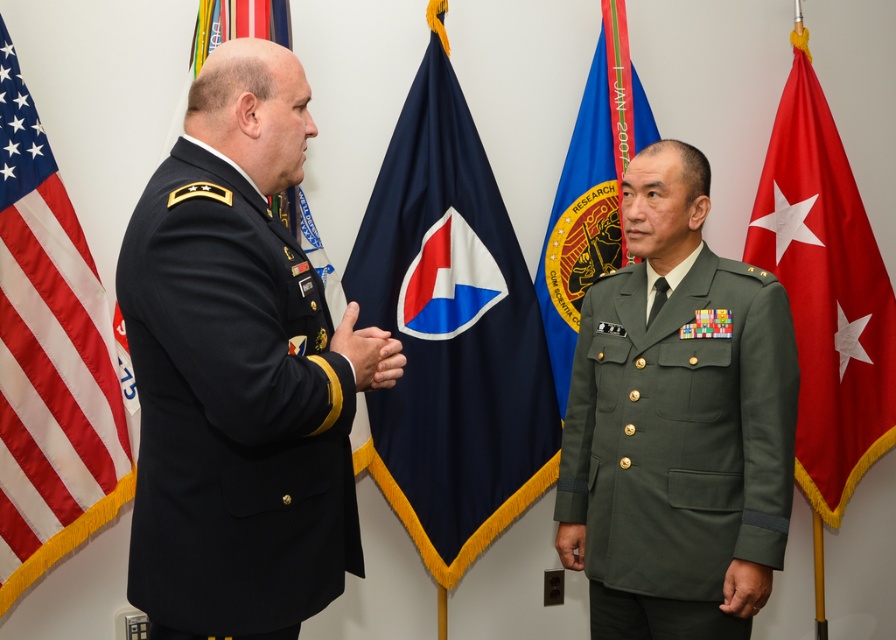
Can you confirm if red/white striped fabric at left is wider than blue fabric flag at center?

No.

Is red/white striped fabric at left thinner than blue fabric flag at center?

Yes.

Where is `red/white striped fabric at left`? The image size is (896, 640). red/white striped fabric at left is located at coordinates (49, 358).

Is navy blue fabric flag at center thinner than blue fabric flag at upper left?

No, navy blue fabric flag at center is not thinner than blue fabric flag at upper left.

Who is more distant from viewer, (458, 545) or (285, 42)?

The point (458, 545) is more distant.

Which is in front, point (548, 468) or point (254, 10)?

Positioned in front is point (254, 10).

Where is `navy blue fabric flag at center`? The image size is (896, 640). navy blue fabric flag at center is located at coordinates (450, 332).

Does point (498, 522) lie in front of point (362, 355)?

No, (498, 522) is behind (362, 355).

Can you confirm if navy blue fabric flag at center is taller than matte black hand at center?

Yes.

Identify the location of navy blue fabric flag at center. (450, 332).